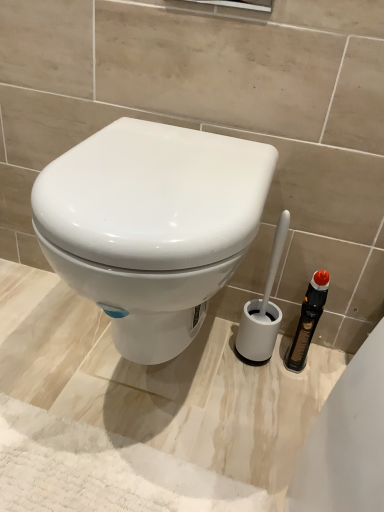
The height and width of the screenshot is (512, 384). I want to click on vacant space situated on the left part of white plastic toilet brush at right, so click(197, 361).